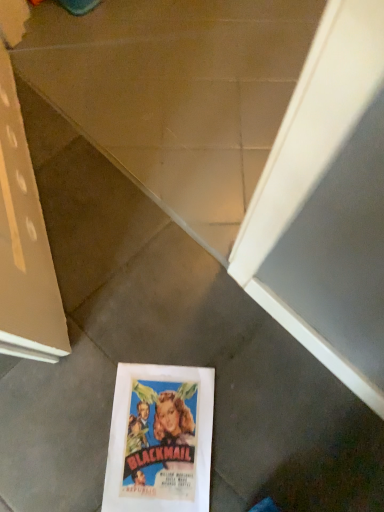
This screenshot has width=384, height=512. What do you see at coordinates (160, 439) in the screenshot? I see `colorful paper poster at lower center` at bounding box center [160, 439].

Identify the location of colorful paper poster at lower center. This screenshot has height=512, width=384. (160, 439).

The height and width of the screenshot is (512, 384). Identify the location of colorful paper poster at lower center. (160, 439).